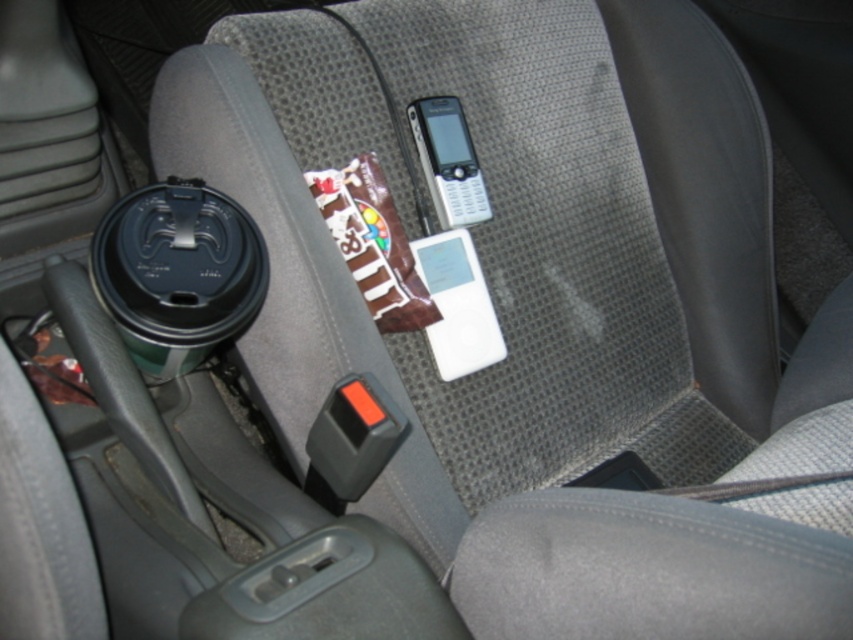
Between white matte ipod at center and silver metallic phone at center, which one has less height?

Standing shorter between the two is silver metallic phone at center.

Which is above, white matte ipod at center or silver metallic phone at center?

silver metallic phone at center

Where is `white matte ipod at center`? white matte ipod at center is located at coordinates (457, 305).